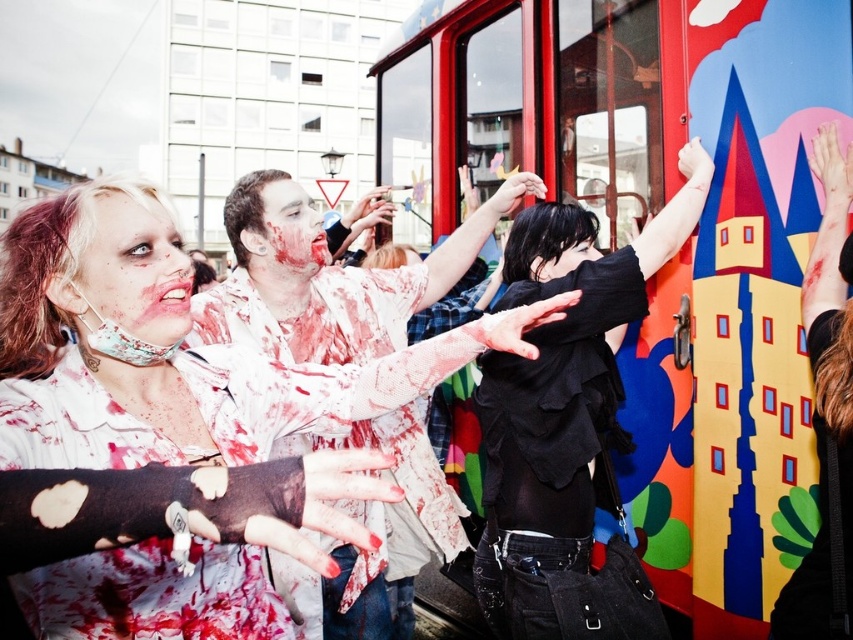
Can you confirm if painted wooden door at center is positioned to the right of matte white shirt at center?

Correct, you'll find painted wooden door at center to the right of matte white shirt at center.

This screenshot has height=640, width=853. Describe the element at coordinates (640, 221) in the screenshot. I see `painted wooden door at center` at that location.

The height and width of the screenshot is (640, 853). What are the coordinates of `painted wooden door at center` in the screenshot? It's located at (640, 221).

Who is more forward, (608, 310) or (561, 269)?

Point (608, 310) is more forward.

Who is positioned more to the left, black matte dress at upper right or smooth black hair at center?

black matte dress at upper right

Find the location of a particular element. The height and width of the screenshot is (640, 853). black matte dress at upper right is located at coordinates (563, 387).

Does point (354, 348) lie in front of point (263, 204)?

No.

Is point (323, 614) farther from camera compared to point (267, 253)?

That is False.

Where is `matte white shirt at center`? This screenshot has width=853, height=640. matte white shirt at center is located at coordinates (334, 288).